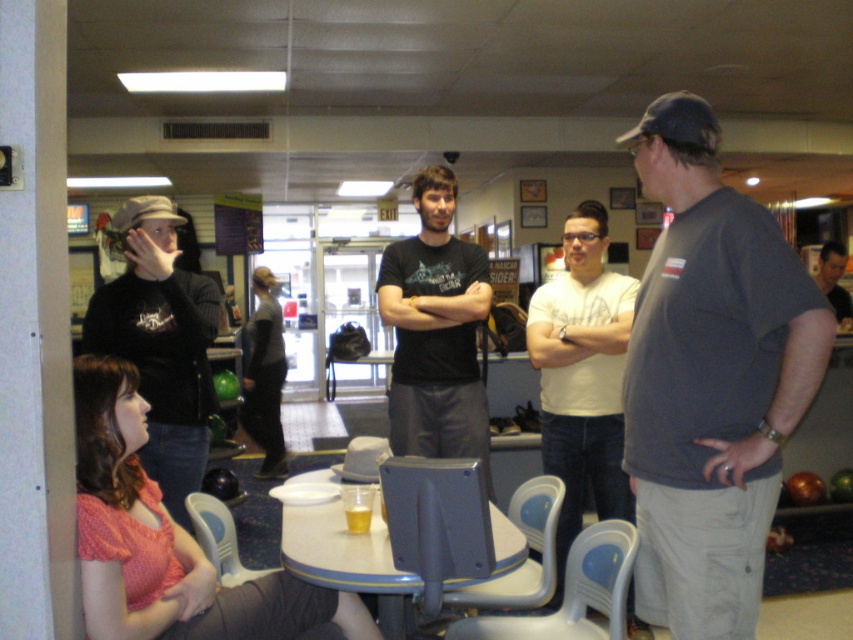
You are standing at the entrance of the bowling alley and see the white plastic chair at center and the matte black shirt at center. Which object is closer to you?

The white plastic chair at center is closer to the viewer than the matte black shirt at center.